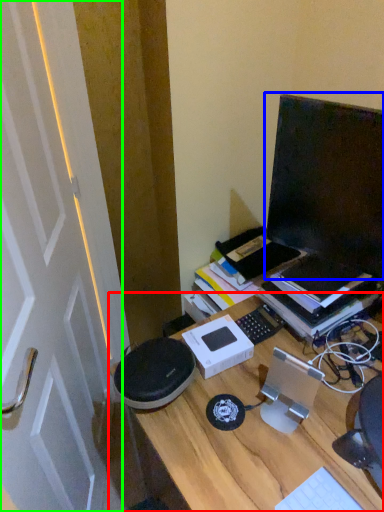
Question: Considering the real-world distances, which object is closest to desk (highlighted by a red box)? computer monitor (highlighted by a blue box) or door (highlighted by a green box).

Choices:
 (A) computer monitor
 (B) door

Answer: (A)